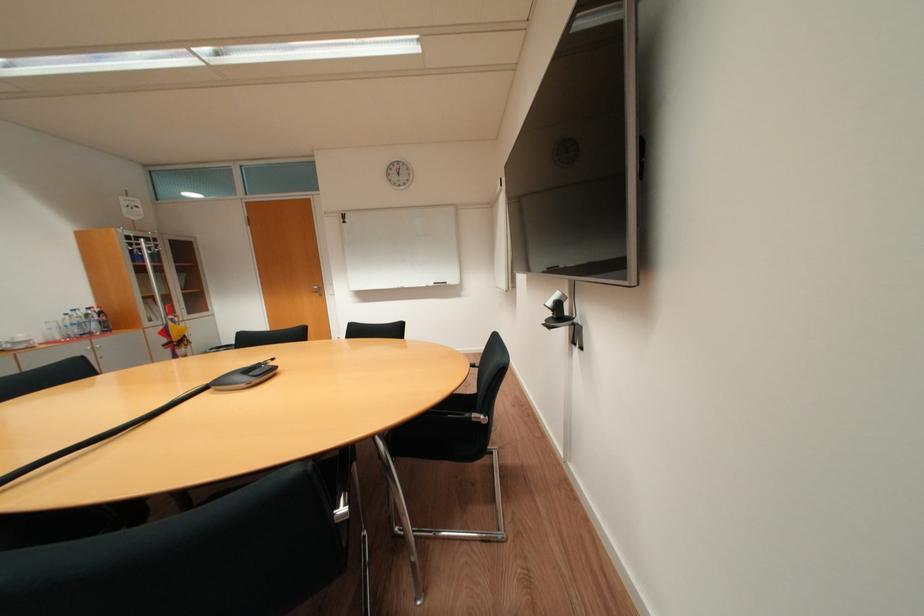
Where would you sit the black chair sitting surface? Please return your answer as a coordinate pair (x, y).

(442, 410)